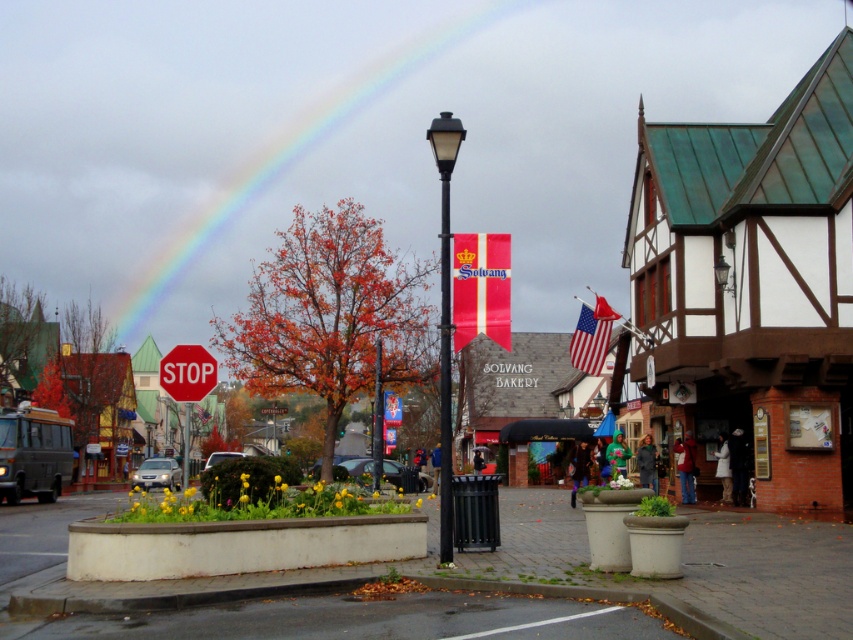
Who is positioned more to the left, american flag at center or metallic stop sign at center?

metallic stop sign at center is more to the left.

Between american flag at center and metallic stop sign at center, which one has more height?

metallic stop sign at center

Find the location of `american flag at center`. american flag at center is located at coordinates (589, 340).

You are a GUI agent. You are given a task and a screenshot of the screen. Output one action in this format:
    pyautogui.click(x=<x>, y=<y>)
    Task: Click on the american flag at center
    
    Given the screenshot: What is the action you would take?
    pyautogui.click(x=589, y=340)

Between red fabric banner at center and metallic stop sign at center, which one is positioned higher?

red fabric banner at center is higher up.

From the picture: Does red fabric banner at center have a greater width compared to metallic stop sign at center?

No.

Between point (503, 342) and point (265, 412), which one is positioned behind?

The point (265, 412) is more distant.

Locate an element on the screen. This screenshot has height=640, width=853. red fabric banner at center is located at coordinates (480, 288).

Is point (376, 77) positioned in front of point (444, 208)?

No, it is behind (444, 208).

Is rainbow at upper center further to the viewer compared to black metal pole at center?

Yes.

Which is in front, point (293, 156) or point (450, 300)?

Point (450, 300)

The image size is (853, 640). I want to click on rainbow at upper center, so [288, 157].